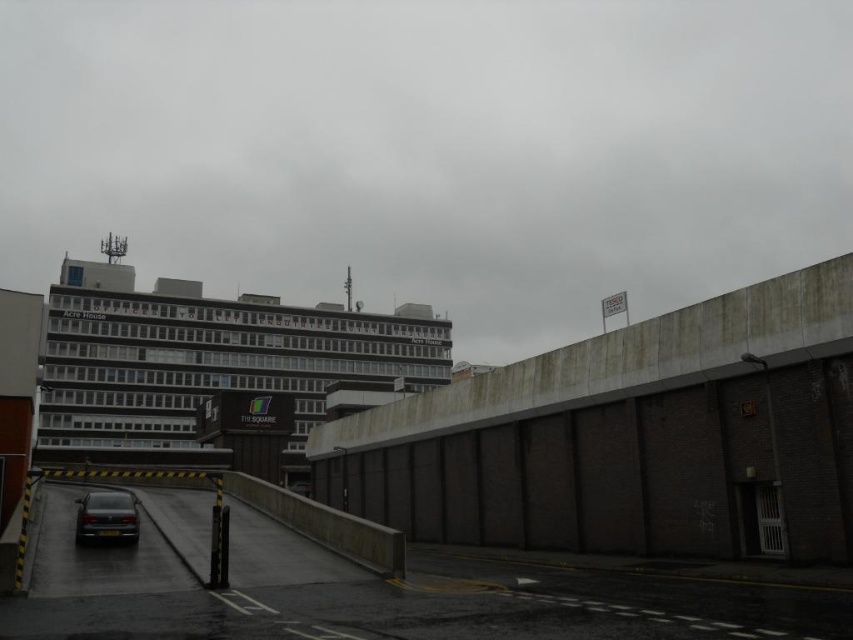
Question: Can you confirm if dark gray concrete building at upper center is positioned to the left of dark gray metallic car at lower left?

Choices:
 (A) yes
 (B) no

Answer: (B)

Question: Is concrete wall at center in front of dark gray metallic car at lower left?

Choices:
 (A) no
 (B) yes

Answer: (B)

Question: Can you confirm if concrete wall at center is smaller than dark gray metallic car at lower left?

Choices:
 (A) yes
 (B) no

Answer: (B)

Question: Which point appears closest to the camera in this image?

Choices:
 (A) (548, 136)
 (B) (131, 499)
 (C) (90, 326)
 (D) (614, 470)

Answer: (B)

Question: Which of the following is the farthest from the observer?

Choices:
 (A) gray concrete building at upper center
 (B) dark gray metallic car at lower left
 (C) dark gray concrete building at upper center

Answer: (C)

Question: Which object appears farthest from the camera in this image?

Choices:
 (A) concrete wall at center
 (B) gray concrete building at upper center
 (C) dark gray metallic car at lower left

Answer: (B)